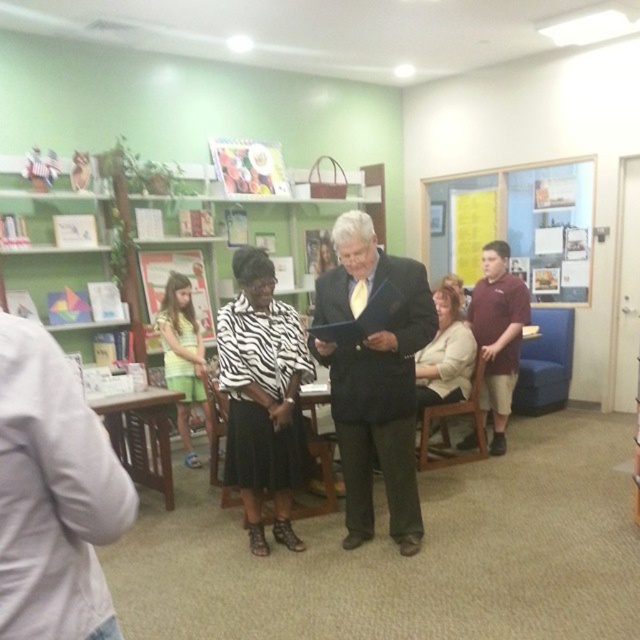
Question: Which is nearer to the yellow-green shorts at left?

Choices:
 (A) zebra print blouse at center
 (B) maroon shirt at right
 (C) black suit at center
 (D) matte beige blouse at center

Answer: (A)

Question: Can you confirm if zebra print blouse at center is positioned to the left of matte beige blouse at center?

Choices:
 (A) no
 (B) yes

Answer: (B)

Question: Where is yellow paper at upper center located in relation to matte beige blouse at center in the image?

Choices:
 (A) right
 (B) left

Answer: (A)

Question: Which object appears farthest from the camera in this image?

Choices:
 (A) zebra print blouse at center
 (B) yellow-green shorts at left
 (C) black suit at center
 (D) matte beige blouse at center

Answer: (B)

Question: Which point is closer to the camera?

Choices:
 (A) zebra print blouse at center
 (B) matte black suit at center
 (C) black suit at center

Answer: (B)

Question: Can you confirm if yellow paper at upper center is positioned below yellow-green shorts at left?

Choices:
 (A) yes
 (B) no

Answer: (B)